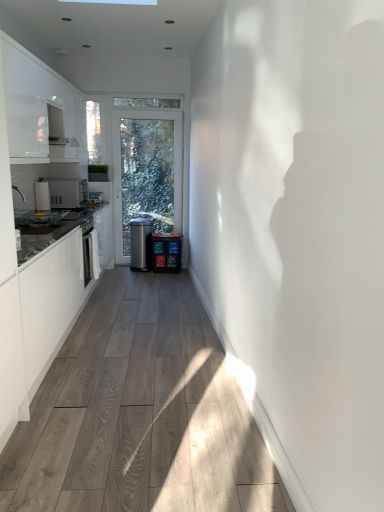
Question: Is satin silver water cooler at center, positioned as the 2th water cooler in right-to-left order, facing towards satin silver microwave at left?

Choices:
 (A) yes
 (B) no

Answer: (B)

Question: Does satin silver water cooler at center, arranged as the 1th water cooler when viewed from the left, have a greater width compared to satin silver microwave at left?

Choices:
 (A) no
 (B) yes

Answer: (A)

Question: From the image's perspective, is satin silver water cooler at center, arranged as the 1th water cooler when viewed from the left, below satin silver microwave at left?

Choices:
 (A) yes
 (B) no

Answer: (A)

Question: Can you confirm if satin silver water cooler at center, arranged as the 1th water cooler when viewed from the left, is positioned to the right of satin silver microwave at left?

Choices:
 (A) yes
 (B) no

Answer: (A)

Question: Is satin silver water cooler at center, arranged as the 1th water cooler when viewed from the left, beside satin silver microwave at left?

Choices:
 (A) no
 (B) yes

Answer: (A)

Question: Is matte plastic water cooler at center, the second water cooler in the left-to-right sequence, bigger or smaller than white glossy cabinet at upper left?

Choices:
 (A) big
 (B) small

Answer: (B)

Question: Is point (155, 234) positioned closer to the camera than point (11, 55)?

Choices:
 (A) farther
 (B) closer

Answer: (A)

Question: Considering the positions of matte plastic water cooler at center, which is the first water cooler in right-to-left order, and white glossy cabinet at upper left in the image, is matte plastic water cooler at center, which is the first water cooler in right-to-left order, taller or shorter than white glossy cabinet at upper left?

Choices:
 (A) short
 (B) tall

Answer: (A)

Question: Looking at their shapes, would you say matte plastic water cooler at center, which is the first water cooler in right-to-left order, is wider or thinner than white glossy cabinet at upper left?

Choices:
 (A) thin
 (B) wide

Answer: (A)

Question: From a real-world perspective, is clear glass window screen at upper left physically located above or below satin silver water cooler at center, positioned as the 2th water cooler in right-to-left order?

Choices:
 (A) below
 (B) above

Answer: (B)

Question: From their relative heights in the image, would you say clear glass window screen at upper left is taller or shorter than satin silver water cooler at center, arranged as the 1th water cooler when viewed from the left?

Choices:
 (A) short
 (B) tall

Answer: (B)

Question: Considering their positions, is clear glass window screen at upper left located in front of or behind satin silver water cooler at center, positioned as the 2th water cooler in right-to-left order?

Choices:
 (A) front
 (B) behind

Answer: (A)

Question: Based on their positions, is clear glass window screen at upper left located to the left or right of satin silver water cooler at center, arranged as the 1th water cooler when viewed from the left?

Choices:
 (A) right
 (B) left

Answer: (B)

Question: From the image's perspective, is white glossy countertop at left located above or below matte plastic water cooler at center, the second water cooler in the left-to-right sequence?

Choices:
 (A) below
 (B) above

Answer: (A)

Question: Is point (24, 353) closer or farther from the camera than point (168, 239)?

Choices:
 (A) farther
 (B) closer

Answer: (B)